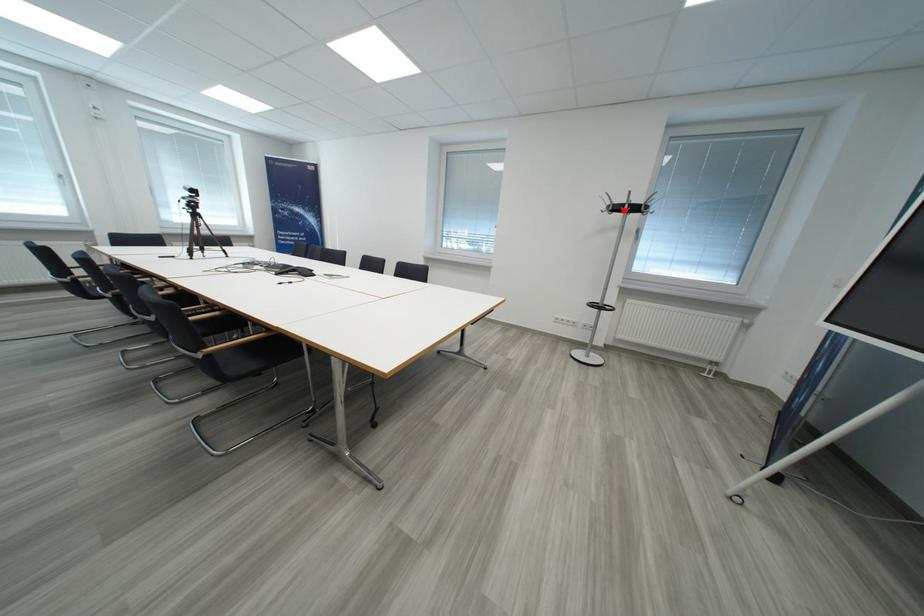
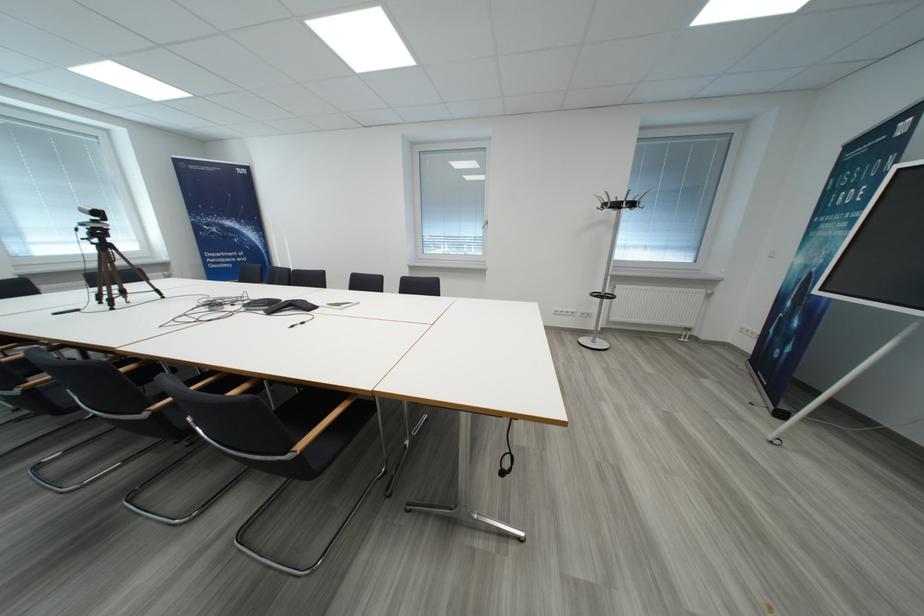
Question: I am providing you with two images of the same scene from different viewpoints. Given a red point in image1, look at the same physical point in image2. Is it:

Choices:
 (A) Closer to the viewpoint
 (B) Farther from the viewpoint

Answer: (B)